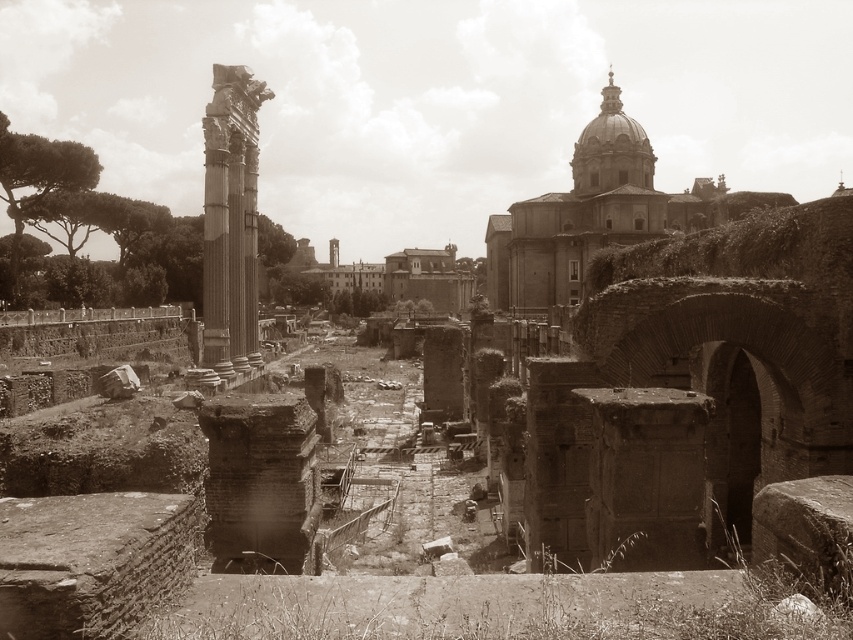
You are an archaeologist standing at the entrance of the ancient Roman forum. You notice the smooth stone dome at upper right and the smooth stone column at left. Which object is closer to you, the archaeologist?

The smooth stone dome at upper right is closer to you than the smooth stone column at left, which is positioned behind it.

You are an archaeologist examining the ancient Roman forum. You notice the smooth stone dome at upper right and the smooth stone column at left. Which of these two structures has a greater width?

The smooth stone dome at upper right has a greater width than the smooth stone column at left.